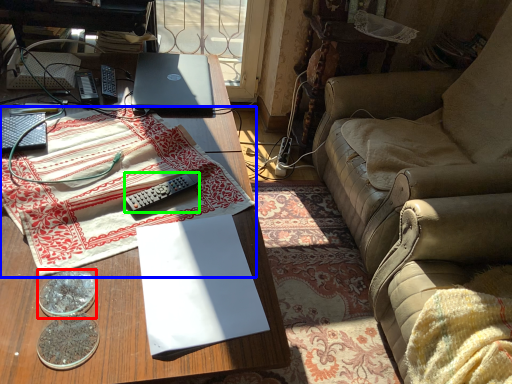
Question: Which object is positioned farthest from coin (highlighted by a red box)? Select from tablecloth (highlighted by a blue box) and remote control (highlighted by a green box).

Choices:
 (A) tablecloth
 (B) remote control

Answer: (A)